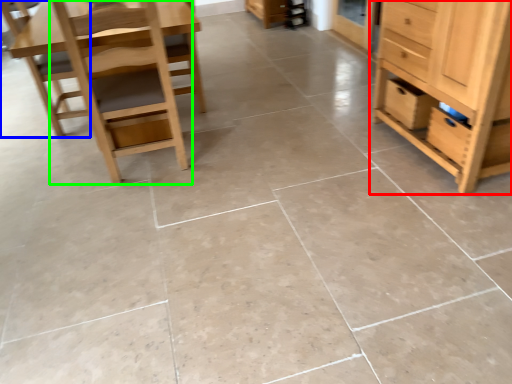
Question: Estimate the real-world distances between objects in this image. Which object is farther from chest of drawers (highlighted by a red box), chair (highlighted by a blue box) or chair (highlighted by a green box)?

Choices:
 (A) chair
 (B) chair

Answer: (A)